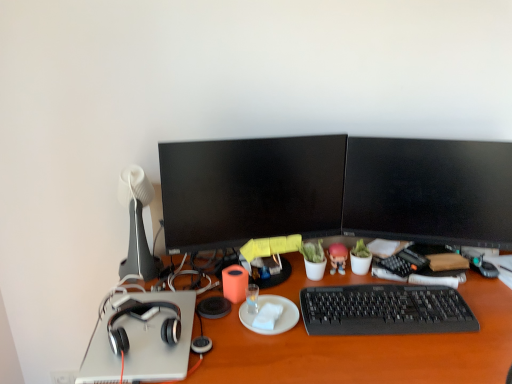
Locate an element on the screen. Image resolution: width=512 pixels, height=384 pixels. free space below black glossy monitor at center, which is counted as the 1th television, starting from the left (from a real-world perspective) is located at coordinates (261, 278).